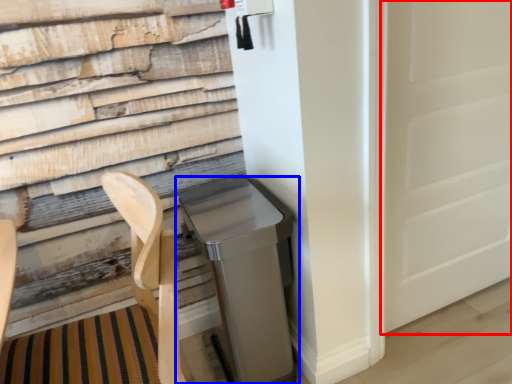
Question: Which of the following is the farthest to the observer, screen door (highlighted by a red box) or waste container (highlighted by a blue box)?

Choices:
 (A) screen door
 (B) waste container

Answer: (A)